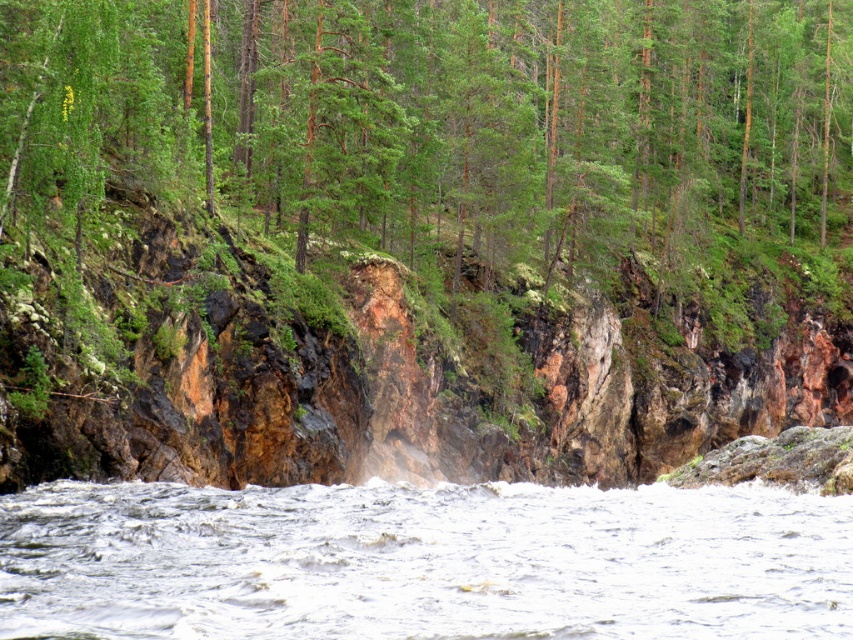
Does green matte rock at center have a larger size compared to white frothy water at center?

Yes.

Is green matte rock at center positioned before white frothy water at center?

No.

Identify the location of green matte rock at center. The image size is (853, 640). (450, 125).

The width and height of the screenshot is (853, 640). What are the coordinates of `green matte rock at center` in the screenshot? It's located at coord(450,125).

Based on the photo, can you confirm if green matte rock at center is wider than rusty rock cliff at center?

Indeed, green matte rock at center has a greater width compared to rusty rock cliff at center.

Is green matte rock at center smaller than rusty rock cliff at center?

Actually, green matte rock at center might be larger than rusty rock cliff at center.

What do you see at coordinates (450, 125) in the screenshot? I see `green matte rock at center` at bounding box center [450, 125].

Identify the location of green matte rock at center. (450, 125).

Can you confirm if rusty rock cliff at center is positioned to the right of white frothy water at center?

Yes, rusty rock cliff at center is to the right of white frothy water at center.

Image resolution: width=853 pixels, height=640 pixels. Describe the element at coordinates (366, 376) in the screenshot. I see `rusty rock cliff at center` at that location.

Is point (103, 378) more distant than point (286, 600)?

That is True.

Identify the location of rusty rock cliff at center. (366, 376).